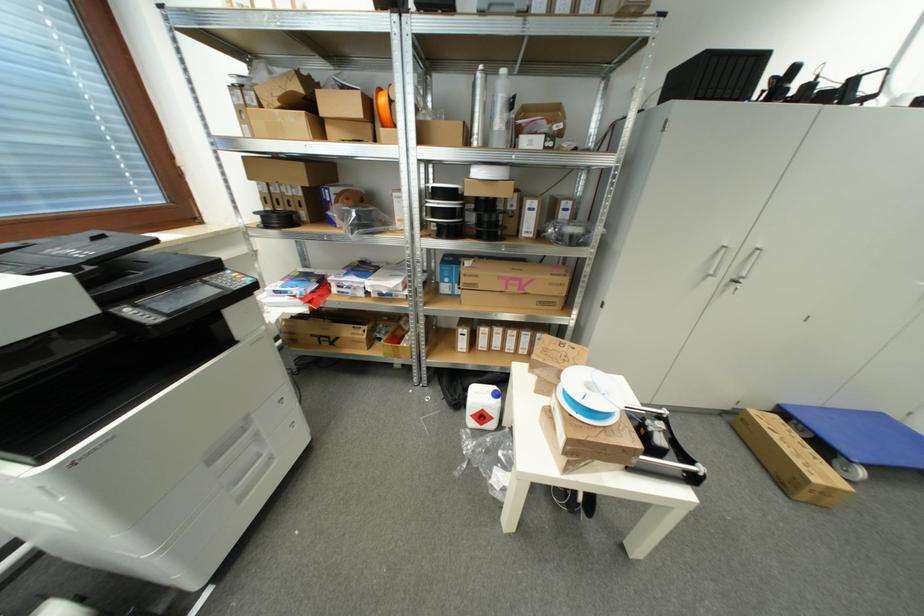
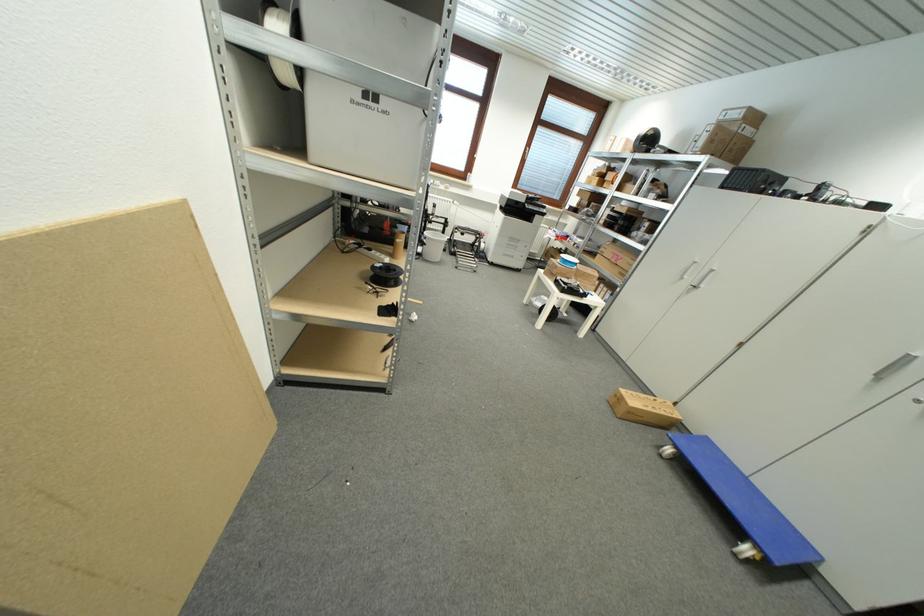
The point at [526,290] is marked in the first image. Where is the corresponding point in the second image?

(621, 262)